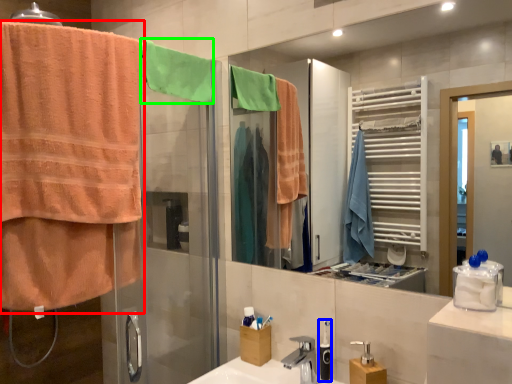
Question: Based on their relative distances, which object is nearer to towel (highlighted by a red box)? Choose from toiletry (highlighted by a blue box) and beach towel (highlighted by a green box).

Choices:
 (A) toiletry
 (B) beach towel

Answer: (B)